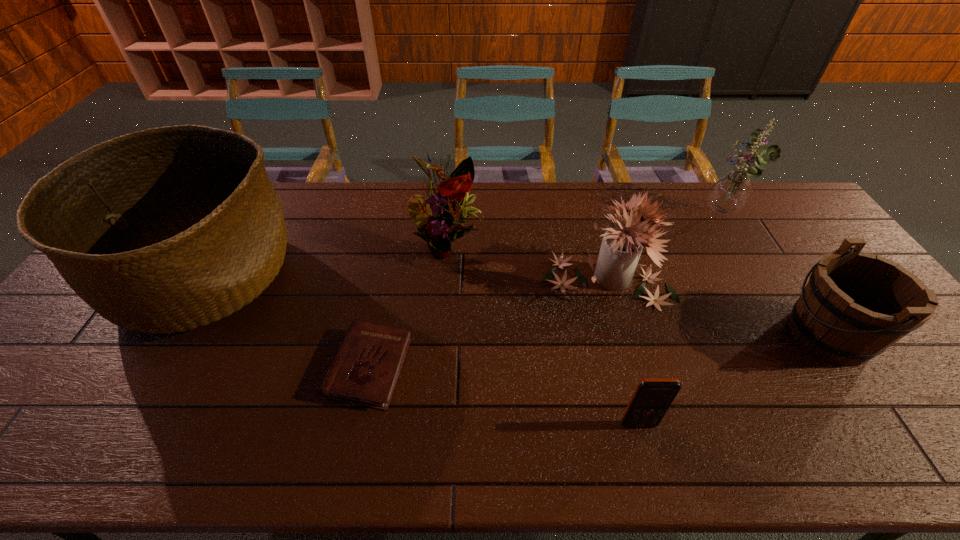
You are a GUI agent. You are given a task and a screenshot of the screen. Output one action in this format:
    pyautogui.click(x=<x>, y=<y>)
    Task: Click on the object that is at the near edge
    
    Given the screenshot: What is the action you would take?
    pyautogui.click(x=652, y=398)

Identify the location of object at the left edge. The width and height of the screenshot is (960, 540). (171, 228).

Identify the location of object at the right edge. (855, 305).

Where is `object situated at the far left corner`? The image size is (960, 540). object situated at the far left corner is located at coordinates (171, 228).

The image size is (960, 540). Find the location of `vacant area at the far edge of the desktop`. vacant area at the far edge of the desktop is located at coordinates (339, 221).

Where is `free space at the near edge of the desktop`? The width and height of the screenshot is (960, 540). free space at the near edge of the desktop is located at coordinates (644, 450).

The height and width of the screenshot is (540, 960). Identify the location of free location at the right edge. (796, 246).

At what (x,y) coordinates should I click in order to perform the action: click on vacant space at the near right corner of the desktop. Please return your answer as a coordinate pair (x, y). Looking at the image, I should click on (950, 453).

Identify the location of free area in between the basket and the rightmost bouquet. This screenshot has width=960, height=540. (464, 246).

Locate an element on the screen. The image size is (960, 540). free space between the rightmost bouquet and the nearest object is located at coordinates (682, 320).